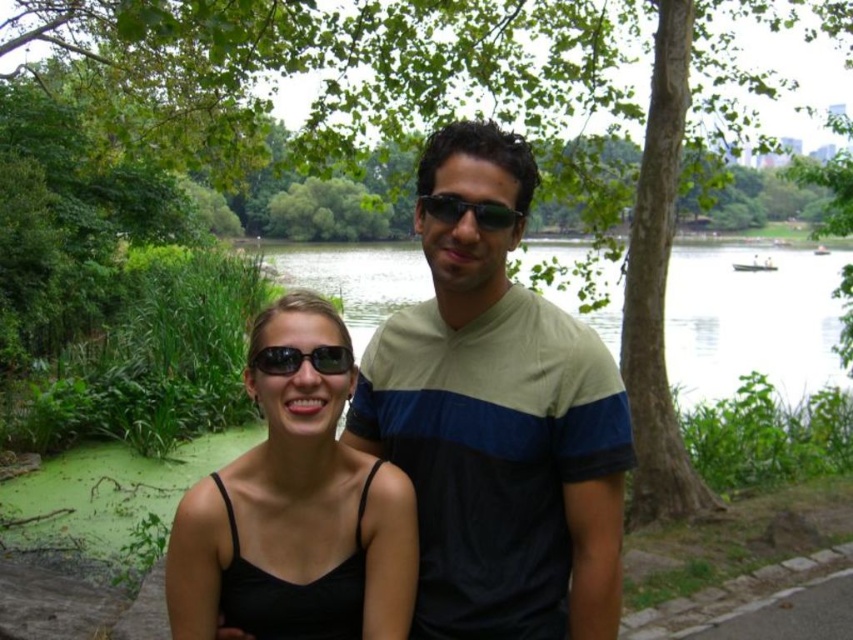
You are a photographer trying to capture a closeup of the light beige cotton shirt at center and the black plastic sunglasses at center. Since you want both objects to appear the same size in the photo, which object should you move closer to the camera?

The light beige cotton shirt at center is larger in size than the black plastic sunglasses at center, so you should move the light beige cotton shirt at center closer to the camera to make them appear the same size in the photo.

You are a photographer trying to capture a clear reflection of the surroundings in the green algae water at center. However, the black reflective sunglasses at center might interfere. Based on their positions, can you determine if the sunglasses are wide enough to block the reflection of the water?

The green algae water at center might be wider than black reflective sunglasses at center, so there is a possibility that parts of the water reflection remain visible beyond the sunglasses, allowing for some reflection capture.

You are standing in the park scene and want to place a small flowerpot between the two points, point (294, 570) and point (335, 259). Which point should the flowerpot be closer to if it needs to be placed closer to the viewer?

The flowerpot should be placed closer to point (294, 570) because it is closer to the viewer than point (335, 259).